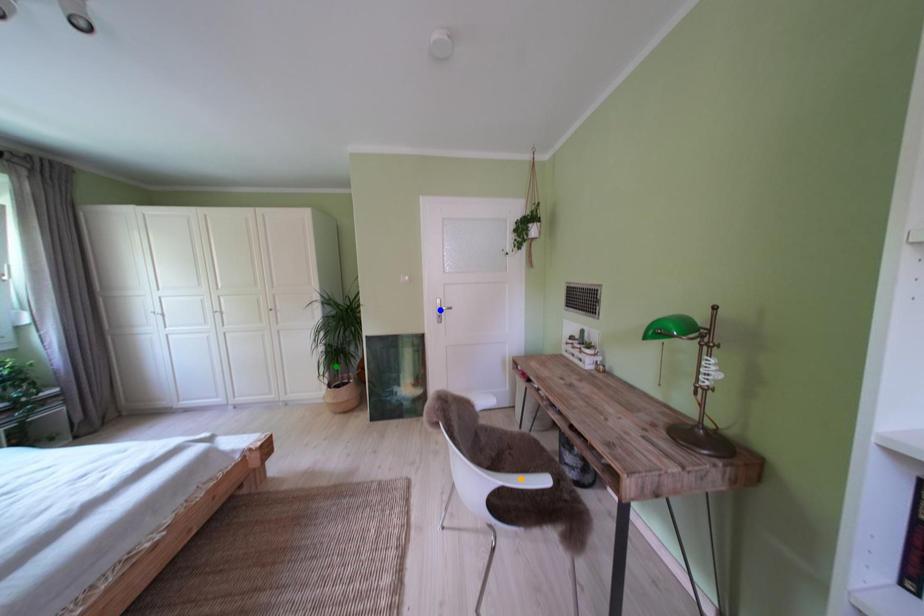
Order these from nearest to farthest:
green point | blue point | orange point

orange point, blue point, green point